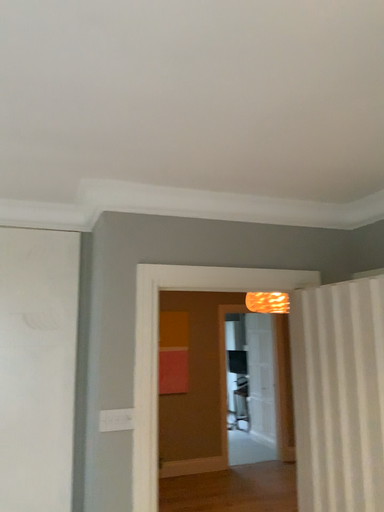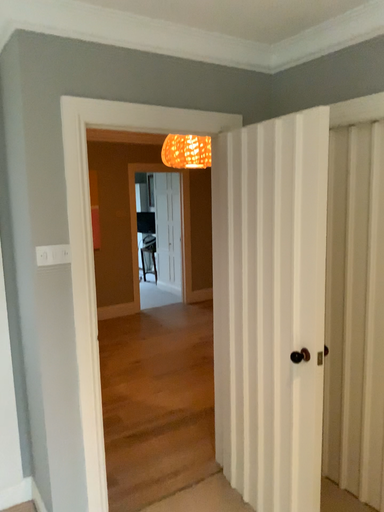
Question: How did the camera likely rotate when shooting the video?

Choices:
 (A) rotated right
 (B) rotated left

Answer: (A)